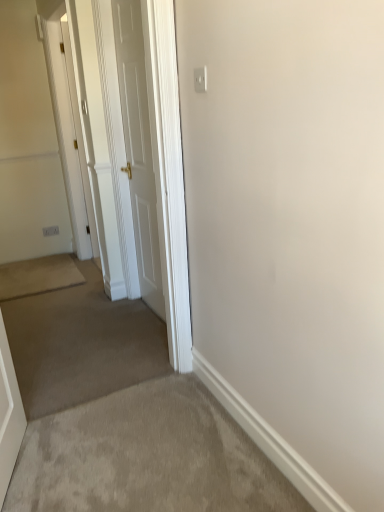
Question: Looking at the image, does white glossy door at center, the 1th door from the front, seem bigger or smaller compared to white glossy door at upper left, which is the second door in front-to-back order?

Choices:
 (A) big
 (B) small

Answer: (A)

Question: Is white glossy door at center, the 2th door from the back, situated inside white glossy door at upper left, the 1th door in the back-to-front sequence, or outside?

Choices:
 (A) inside
 (B) outside

Answer: (B)

Question: In terms of height, does white glossy door at center, which ranks as the second door in left-to-right order, look taller or shorter compared to white glossy door at upper left, which appears as the 1th door when viewed from the left?

Choices:
 (A) tall
 (B) short

Answer: (B)

Question: Is white glossy door at upper left, acting as the 2th door starting from the right, inside or outside of white glossy door at center, marked as the first door in a right-to-left arrangement?

Choices:
 (A) outside
 (B) inside

Answer: (A)

Question: From the image's perspective, relative to white glossy door at center, the 1th door from the front, is white glossy door at upper left, which appears as the 1th door when viewed from the left, above or below?

Choices:
 (A) below
 (B) above

Answer: (B)

Question: Is white glossy door at upper left, the 1th door in the back-to-front sequence, bigger or smaller than white glossy door at center, the 2th door from the back?

Choices:
 (A) big
 (B) small

Answer: (B)

Question: Considering the relative positions of white glossy door at upper left, acting as the 2th door starting from the right, and white glossy door at center, the 2th door from the back, in the image provided, is white glossy door at upper left, acting as the 2th door starting from the right, to the left or to the right of white glossy door at center, the 2th door from the back,?

Choices:
 (A) right
 (B) left

Answer: (B)